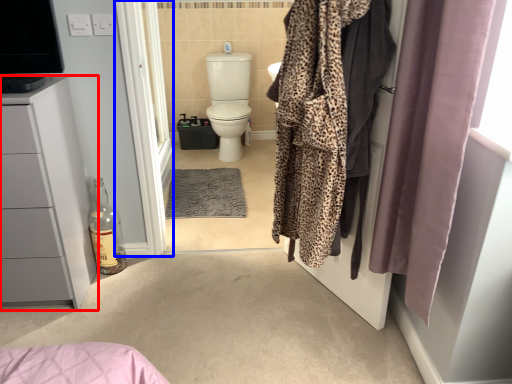
Question: Which object appears closest to the camera in this image, bathroom cabinet (highlighted by a red box) or screen door (highlighted by a blue box)?

Choices:
 (A) bathroom cabinet
 (B) screen door

Answer: (A)